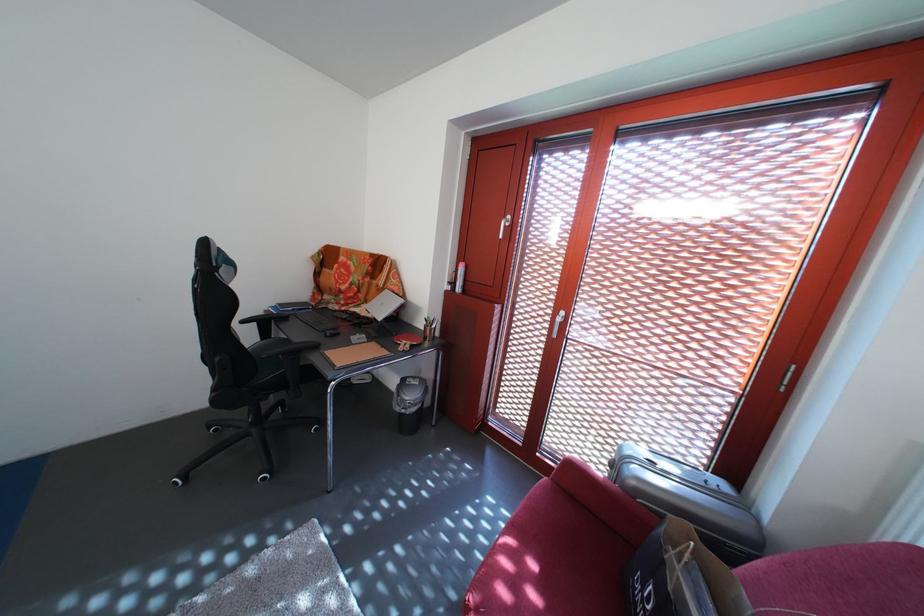
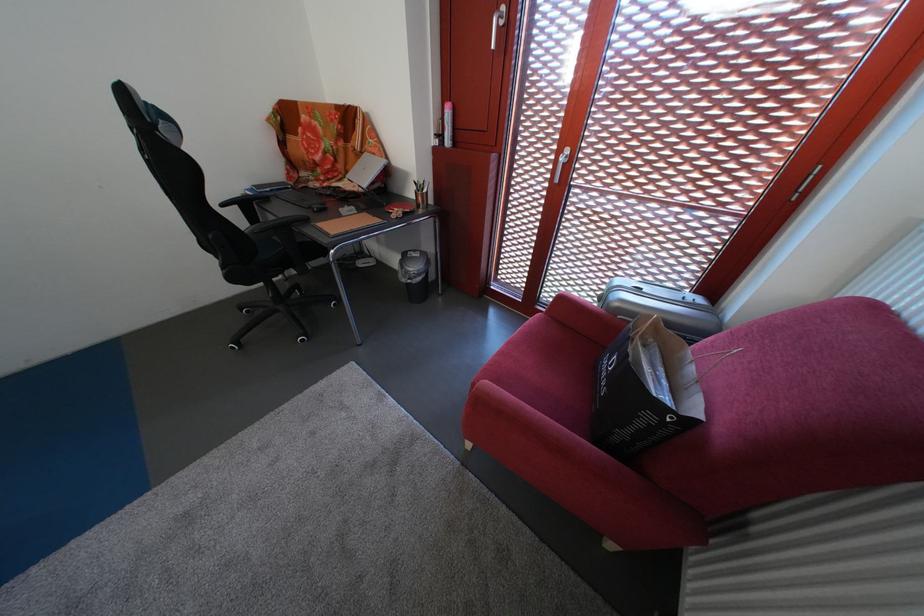
The images are taken continuously from a first-person perspective. In which direction are you moving?

The cameraman moved toward right, backward.